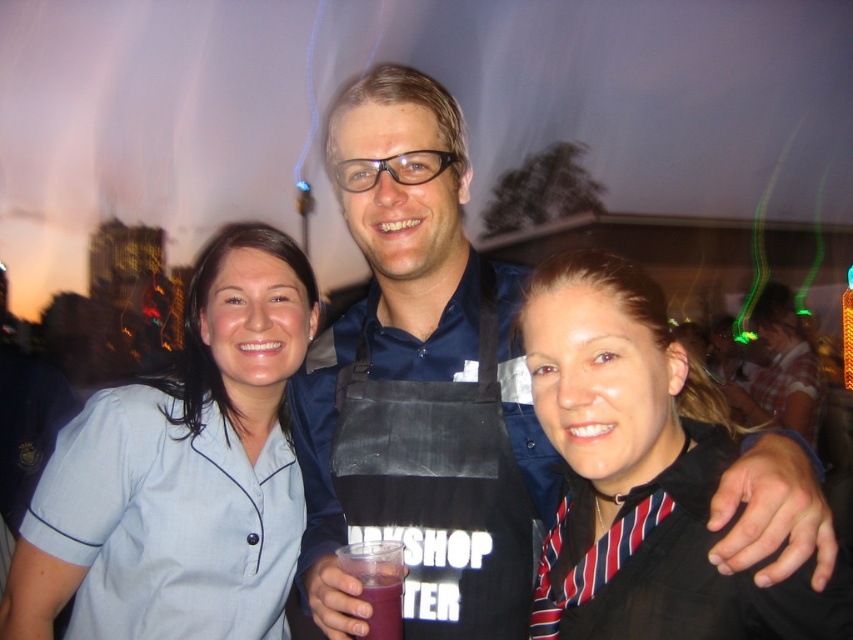
What do you see at coordinates (640, 474) in the screenshot? I see `striped fabric shirt at center` at bounding box center [640, 474].

Is striped fabric shirt at center below purple translucent cup at center?

Actually, striped fabric shirt at center is above purple translucent cup at center.

You are a GUI agent. You are given a task and a screenshot of the screen. Output one action in this format:
    pyautogui.click(x=<x>, y=<y>)
    Task: Click on the striped fabric shirt at center
    
    Given the screenshot: What is the action you would take?
    pyautogui.click(x=640, y=474)

Does light blue fabric shirt at center appear over black apron at center?

No.

Looking at this image, which is more to the left, light blue fabric shirt at center or black apron at center?

From the viewer's perspective, light blue fabric shirt at center appears more on the left side.

Is point (206, 474) positioned behind point (756, 406)?

No.

Where is `light blue fabric shirt at center`? The width and height of the screenshot is (853, 640). light blue fabric shirt at center is located at coordinates (181, 472).

Is point (766, 440) closer to viewer compared to point (624, 400)?

Yes, point (766, 440) is in front of point (624, 400).

Which is more to the left, blue fabric shirt at center or striped fabric shirt at center?

blue fabric shirt at center

Identify the location of blue fabric shirt at center. (409, 317).

Find the location of `blue fabric shirt at center`. blue fabric shirt at center is located at coordinates (409, 317).